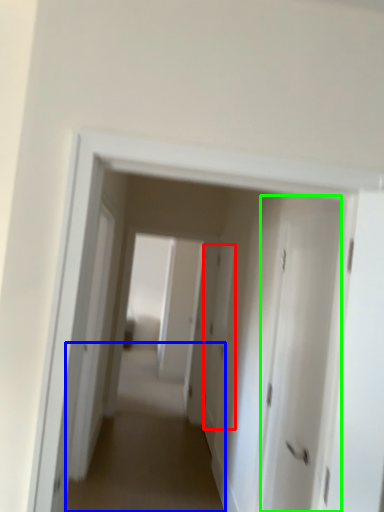
Question: Which is farther away from door (highlighted by a red box)? alley (highlighted by a blue box) or door (highlighted by a green box)?

Choices:
 (A) alley
 (B) door

Answer: (B)